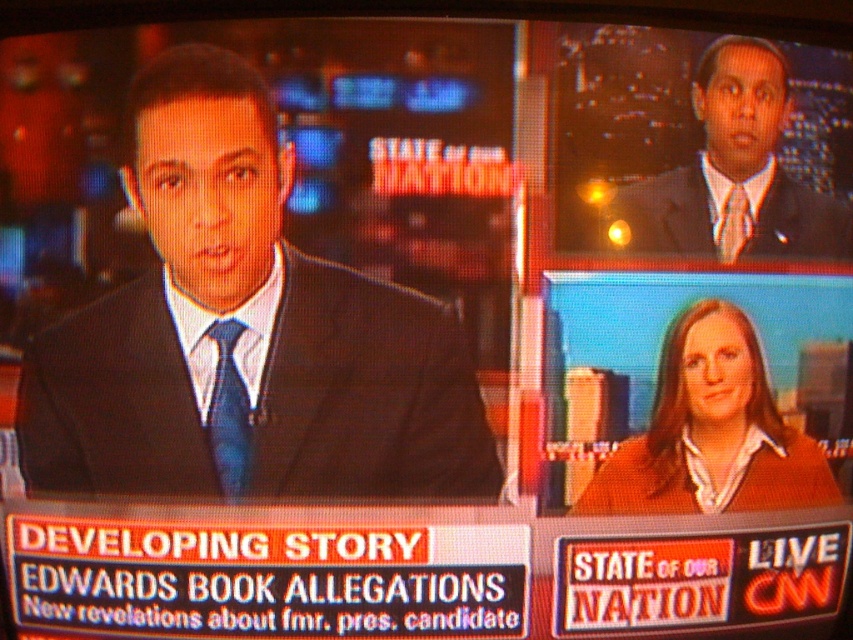
Question: Which object is farther from the camera taking this photo?

Choices:
 (A) matte black suit at upper right
 (B) brown sweater at lower right
 (C) blue silk tie at upper right
 (D) matte black suit at left

Answer: (B)

Question: Can you confirm if matte black suit at upper right is thinner than blue silk tie at center?

Choices:
 (A) yes
 (B) no

Answer: (B)

Question: Is blue silk tie at center to the left of blue silk tie at upper right from the viewer's perspective?

Choices:
 (A) yes
 (B) no

Answer: (A)

Question: Estimate the real-world distances between objects in this image. Which object is closer to the dark suit at upper right?

Choices:
 (A) brown sweater at lower right
 (B) matte black suit at left
 (C) matte black suit at upper right
 (D) blue silk tie at upper right

Answer: (C)

Question: Which object is the closest to the dark suit at upper right?

Choices:
 (A) matte black suit at left
 (B) matte black suit at upper right
 (C) blue silk tie at upper right

Answer: (B)

Question: Can you confirm if dark suit at upper right is thinner than matte black suit at upper right?

Choices:
 (A) yes
 (B) no

Answer: (B)